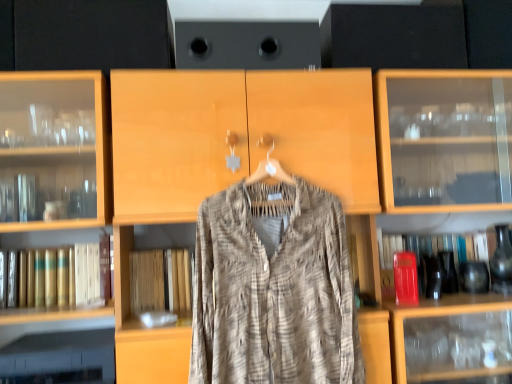
Question: Looking at their shapes, would you say gold leather book at left, the second book from the right, is wider or thinner than textured beige shirt at center?

Choices:
 (A) wide
 (B) thin

Answer: (A)

Question: Considering their positions, is gold leather book at left, which is counted as the first book, starting from the left, located in front of or behind textured beige shirt at center?

Choices:
 (A) front
 (B) behind

Answer: (B)

Question: Estimate the real-world distances between objects in this image. Which object is closer to the gold leather book at left, the second book from the right?

Choices:
 (A) textured beige shirt at center
 (B) red matte book at right, the second book positioned from the left

Answer: (A)

Question: Based on their relative distances, which object is farther from the gold leather book at left, which is counted as the first book, starting from the left?

Choices:
 (A) textured beige shirt at center
 (B) red matte book at right, the second book positioned from the left

Answer: (B)